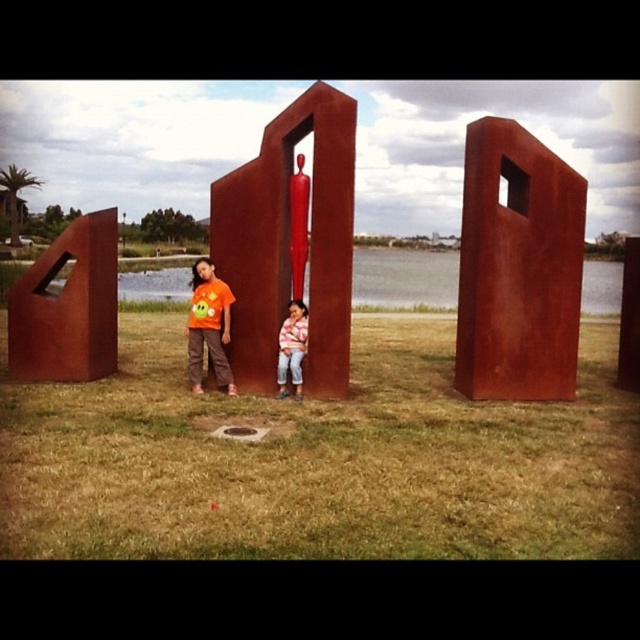
Question: Does rusty metal door at left come behind orange matte shirt at left?

Choices:
 (A) yes
 (B) no

Answer: (A)

Question: Among these objects, which one is farthest from the camera?

Choices:
 (A) orange matte shirt at left
 (B) rusty metal door at left
 (C) striped sweater at center
 (D) rusty metal sculpture at center

Answer: (B)

Question: Does rusty metal sculpture at center appear over orange matte shirt at left?

Choices:
 (A) yes
 (B) no

Answer: (A)

Question: Can you confirm if rusty metal door at center is positioned below rusty metal door at left?

Choices:
 (A) yes
 (B) no

Answer: (B)

Question: Which is nearer to the striped sweater at center?

Choices:
 (A) rusty metal door at center
 (B) orange matte shirt at left
 (C) rusty metal sculpture at center
 (D) rusty metal door at left

Answer: (C)

Question: Which of the following is the closest to the observer?

Choices:
 (A) (332, 260)
 (B) (45, 378)
 (C) (296, 333)
 (D) (211, 348)

Answer: (A)